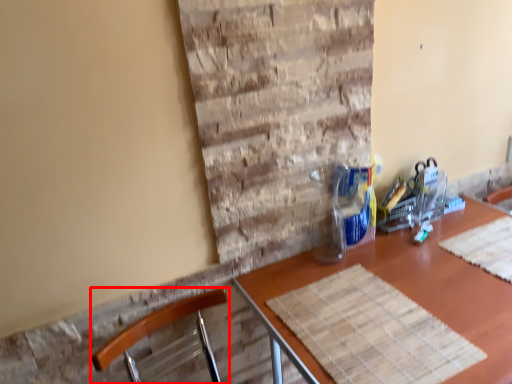
Question: From the image's perspective, considering the relative positions of chair (annotated by the red box) and table in the image provided, where is chair (annotated by the red box) located with respect to the staircase?

Choices:
 (A) above
 (B) below

Answer: (A)